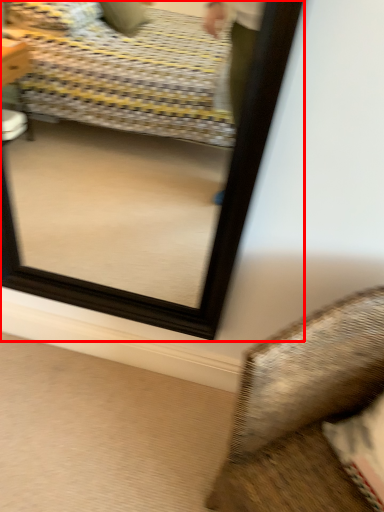
Question: From the image's perspective, where is mirror (annotated by the red box) located in relation to furniture in the image?

Choices:
 (A) below
 (B) above

Answer: (B)